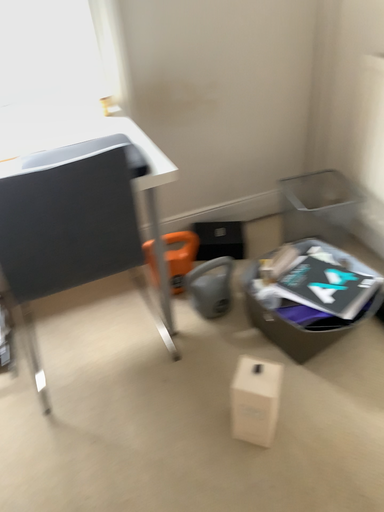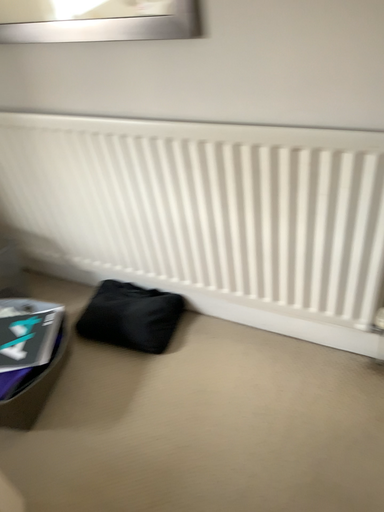
Question: How did the camera likely rotate when shooting the video?

Choices:
 (A) rotated right
 (B) rotated left

Answer: (A)